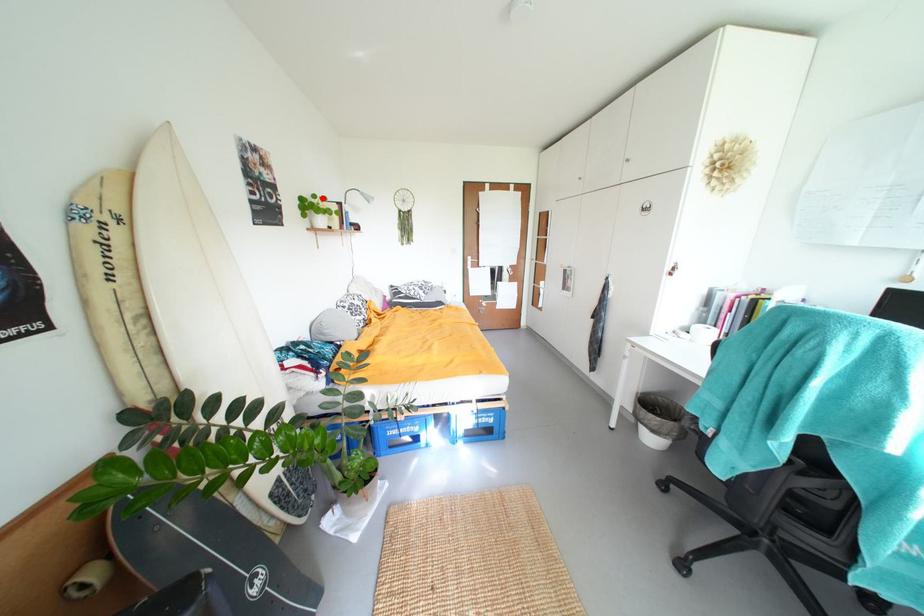
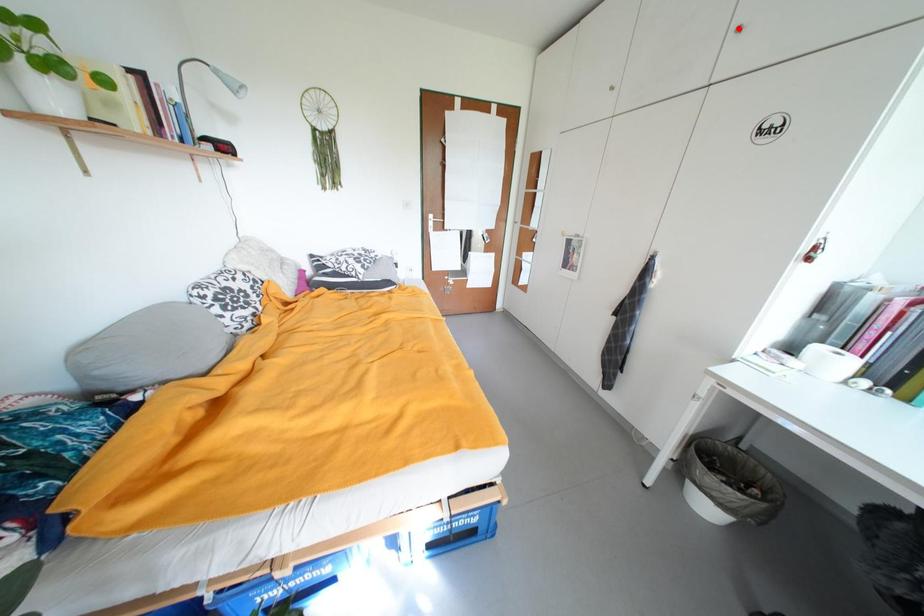
Consider the image. I am providing you with two images of the same scene from different viewpoints. A red point is marked on the first image and another point is marked on the second image. Is the marked point in image1 the same physical position as the marked point in image2?

No